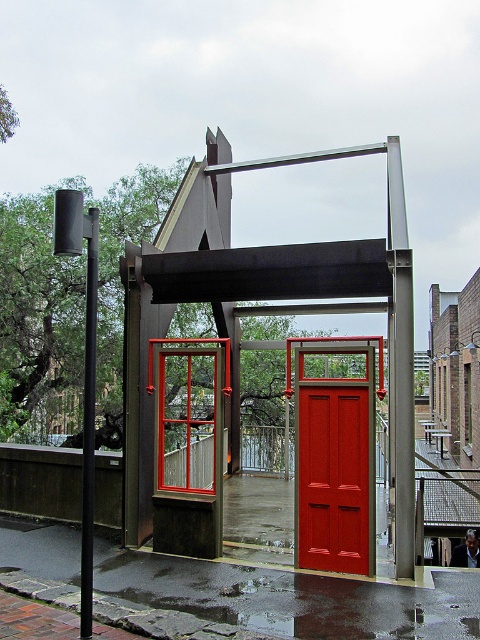
Can you confirm if matte red door at center is positioned below black metal pole at left?

Yes, matte red door at center is below black metal pole at left.

Does matte red door at center have a larger size compared to black metal pole at left?

Yes, matte red door at center is bigger than black metal pole at left.

Where is `matte red door at center`? matte red door at center is located at coordinates (334, 477).

This screenshot has height=640, width=480. I want to click on matte red door at center, so click(334, 477).

Is point (389, 349) closer to viewer compared to point (302, 556)?

No, it is not.

Is point (305, 556) more distant than point (335, 461)?

Yes, it is behind point (335, 461).

Does point (312, 474) lie behind point (365, 532)?

Yes, point (312, 474) is behind point (365, 532).

Where is `metallic red door at center`? metallic red door at center is located at coordinates (267, 300).

Which is below, metallic red door at center or black metal pole at left?

black metal pole at left is below.

Who is taller, metallic red door at center or black metal pole at left?

black metal pole at left is taller.

Who is more distant from viewer, (308, 266) or (87, 400)?

Point (308, 266)

The height and width of the screenshot is (640, 480). What are the coordinates of `metallic red door at center` in the screenshot? It's located at (267, 300).